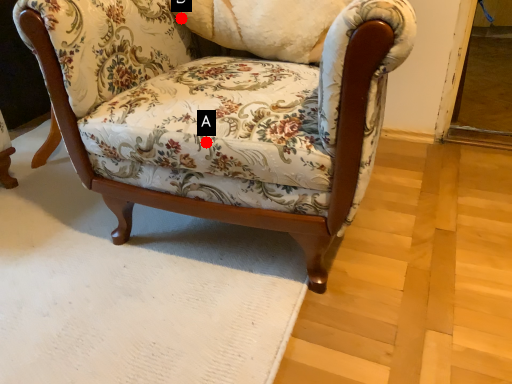
Question: Two points are circled on the image, labeled by A and B beside each circle. Which point is closer to the camera?

Choices:
 (A) A is closer
 (B) B is closer

Answer: (A)